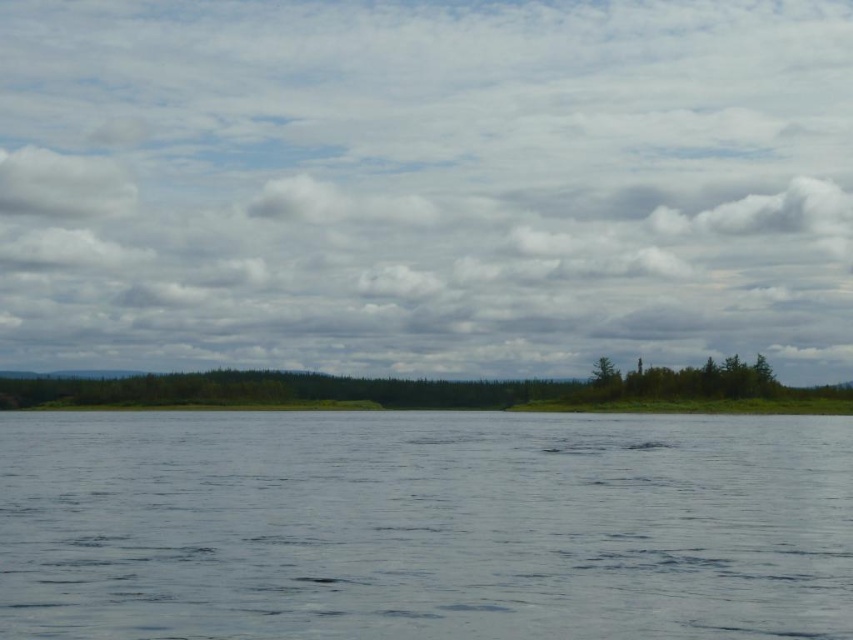
Question: Can you confirm if cloudy sky at center is positioned above green matte trees at center?

Choices:
 (A) yes
 (B) no

Answer: (A)

Question: Which object is the closest to the cloudy sky at center?

Choices:
 (A) green matte tree at upper right
 (B) clear water at center

Answer: (A)

Question: Among these points, which one is farthest from the camera?

Choices:
 (A) (538, 131)
 (B) (173, 540)

Answer: (A)

Question: Observing the image, what is the correct spatial positioning of clear water at center in reference to green matte tree at upper right?

Choices:
 (A) left
 (B) right

Answer: (A)

Question: Which of the following is the closest to the observer?

Choices:
 (A) [x=701, y=380]
 (B) [x=158, y=605]
 (C) [x=590, y=372]
 (D) [x=549, y=92]

Answer: (B)

Question: Is clear water at center smaller than green matte tree at upper right?

Choices:
 (A) no
 (B) yes

Answer: (A)